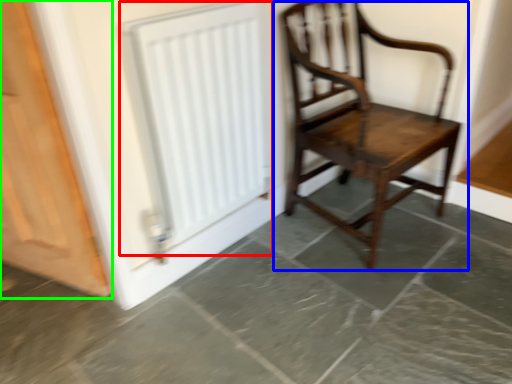
Question: Which object is the closest to the radiator (highlighted by a red box)? Choose among these: chair (highlighted by a blue box) or door (highlighted by a green box).

Choices:
 (A) chair
 (B) door

Answer: (B)